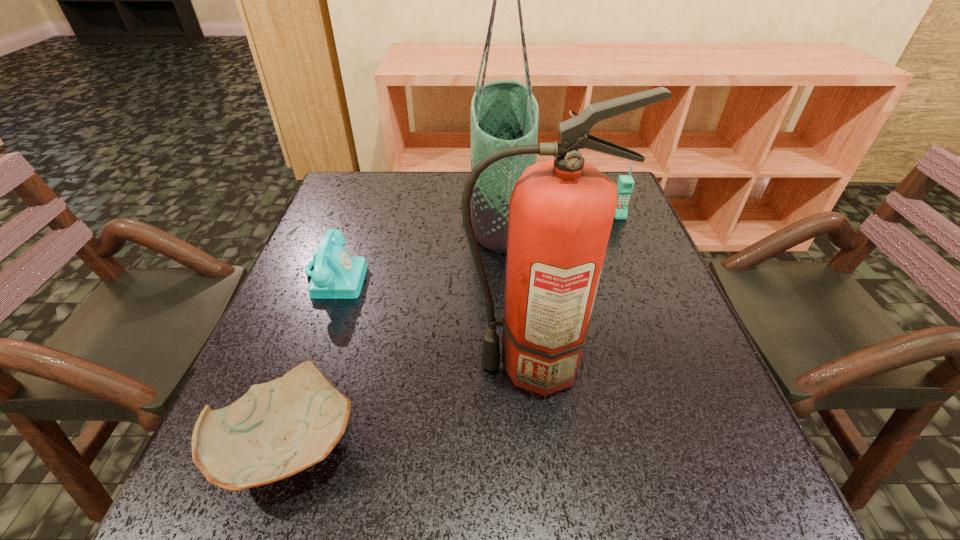
Locate an element on the screen. The width and height of the screenshot is (960, 540). empty location between the shortest object and the telephone is located at coordinates (313, 360).

Where is `vacant area that lies between the telephone and the shortest object`? The image size is (960, 540). vacant area that lies between the telephone and the shortest object is located at coordinates (313, 360).

You are a GUI agent. You are given a task and a screenshot of the screen. Output one action in this format:
    pyautogui.click(x=<x>, y=<y>)
    Task: Click on the free spot between the tote bag and the telephone
    The width and height of the screenshot is (960, 540).
    Given the screenshot: What is the action you would take?
    pyautogui.click(x=418, y=245)

At what (x,y) coordinates should I click in order to perform the action: click on the fourth closest object to the fire extinguisher. Please return your answer as a coordinate pair (x, y). The image size is (960, 540). Looking at the image, I should click on (625, 184).

Where is `the second closest object relative to the rightmost object`? the second closest object relative to the rightmost object is located at coordinates (561, 211).

Identify the location of vacant space that satisfies the following two spatial constraints: 1. on the back side of the pottery; 2. on the right side of the tote bag. (368, 213).

Locate an element on the screen. vacant region that satisfies the following two spatial constraints: 1. on the keypad of the cellular telephone; 2. on the dial of the fourth tallest object is located at coordinates (644, 276).

Image resolution: width=960 pixels, height=540 pixels. I want to click on vacant area in the image that satisfies the following two spatial constraints: 1. on the keypad of the rightmost object; 2. on the nozzle of the fire extinguisher, so click(681, 365).

Identify the location of free location that satisfies the following two spatial constraints: 1. on the dial of the second shortest object; 2. on the right side of the pottery. The width and height of the screenshot is (960, 540). (275, 443).

Where is `vacant space that satisfies the following two spatial constraints: 1. on the front side of the tote bag; 2. on the dial of the fourth tallest object`? The width and height of the screenshot is (960, 540). vacant space that satisfies the following two spatial constraints: 1. on the front side of the tote bag; 2. on the dial of the fourth tallest object is located at coordinates (505, 276).